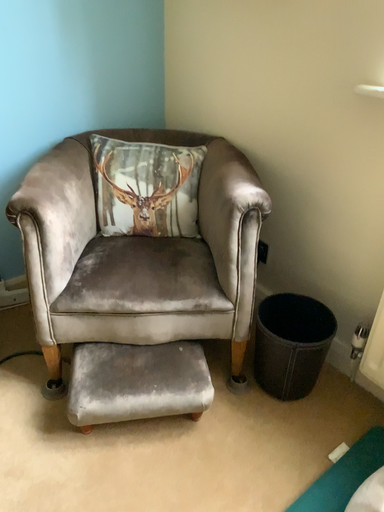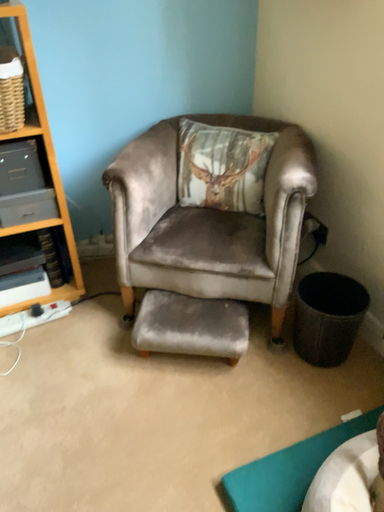
Question: How did the camera likely rotate when shooting the video?

Choices:
 (A) rotated right
 (B) rotated left

Answer: (B)